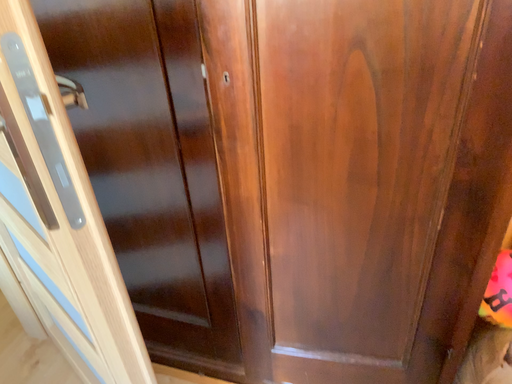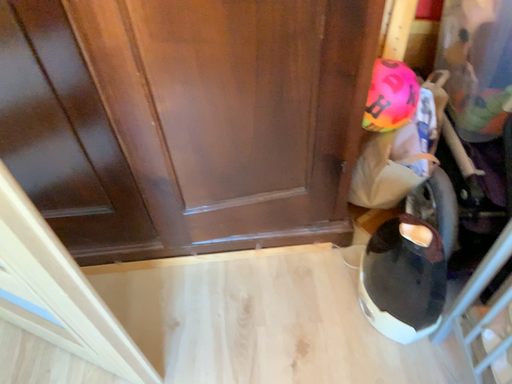
Question: Which way did the camera rotate in the video?

Choices:
 (A) rotated downward
 (B) rotated upward

Answer: (A)